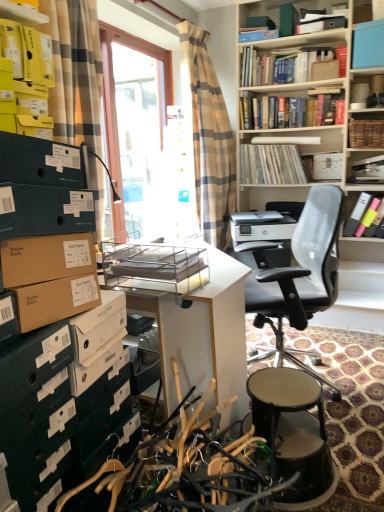
Question: Could you tell me if green cardboard boxes at lower left, positioned as the 1th shelf in bottom-to-top order, is facing wooden vinyl records at upper center, which appears as the 2th book when ordered from the bottom?

Choices:
 (A) yes
 (B) no

Answer: (B)

Question: From a real-world perspective, is green cardboard boxes at lower left, positioned as the 1th shelf in bottom-to-top order, over wooden vinyl records at upper center, which appears as the 2th book when ordered from the bottom?

Choices:
 (A) no
 (B) yes

Answer: (A)

Question: Can you see green cardboard boxes at lower left, the 2th shelf from the right, touching wooden vinyl records at upper center, acting as the 3th book starting from the top?

Choices:
 (A) yes
 (B) no

Answer: (B)

Question: Is green cardboard boxes at lower left, which is the 3th shelf in top-to-bottom order, at the right side of wooden vinyl records at upper center, which appears as the 2th book when ordered from the bottom?

Choices:
 (A) yes
 (B) no

Answer: (B)

Question: From the image's perspective, would you say green cardboard boxes at lower left, which is the 2th shelf from left to right, is shown under wooden vinyl records at upper center, which appears as the 2th book when ordered from the bottom?

Choices:
 (A) no
 (B) yes

Answer: (B)

Question: From a real-world perspective, is green cardboard boxes at lower left, placed as the first shelf when sorted from front to back, positioned under wooden vinyl records at upper center, which appears as the 2th book when ordered from the bottom, based on gravity?

Choices:
 (A) no
 (B) yes

Answer: (B)

Question: Considering the relative positions of white matte printer at center and pastel matte highlighters at upper right, placed as the fourth book when sorted from top to bottom, in the image provided, is white matte printer at center to the left of pastel matte highlighters at upper right, placed as the fourth book when sorted from top to bottom, from the viewer's perspective?

Choices:
 (A) yes
 (B) no

Answer: (A)

Question: Does white matte printer at center have a lesser width compared to pastel matte highlighters at upper right, placed as the fourth book when sorted from top to bottom?

Choices:
 (A) no
 (B) yes

Answer: (A)

Question: Is the position of white matte printer at center more distant than that of pastel matte highlighters at upper right, the 1th book positioned from the bottom?

Choices:
 (A) no
 (B) yes

Answer: (A)

Question: Is white matte printer at center at the right side of pastel matte highlighters at upper right, the 1th book positioned from the bottom?

Choices:
 (A) no
 (B) yes

Answer: (A)

Question: Is white matte printer at center shorter than pastel matte highlighters at upper right, the 1th book positioned from the bottom?

Choices:
 (A) yes
 (B) no

Answer: (A)

Question: Is white matte printer at center surrounding pastel matte highlighters at upper right, the 1th book positioned from the bottom?

Choices:
 (A) no
 (B) yes

Answer: (A)

Question: From a real-world perspective, does woven brown basket at upper right, the 3th shelf in the front-to-back sequence, stand above yellow cardboard boxes at upper left, positioned as the 3th shelf in right-to-left order?

Choices:
 (A) yes
 (B) no

Answer: (B)